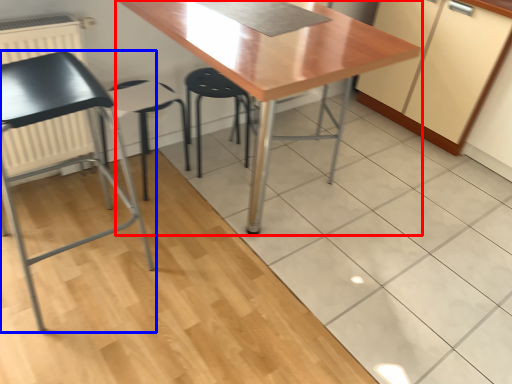
Question: Which object appears closest to the camera in this image, table (highlighted by a red box) or chair (highlighted by a blue box)?

Choices:
 (A) table
 (B) chair

Answer: (B)